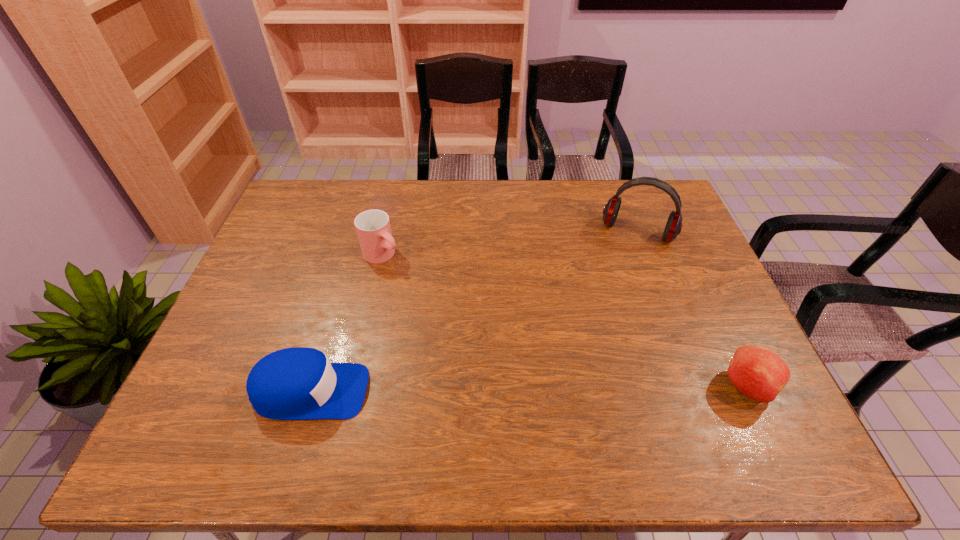
Where is `empty space between the cup and the earphone`? The image size is (960, 540). empty space between the cup and the earphone is located at coordinates (510, 243).

I want to click on free spot between the cup and the earphone, so click(x=510, y=243).

You are a GUI agent. You are given a task and a screenshot of the screen. Output one action in this format:
    pyautogui.click(x=<x>, y=<y>)
    Task: Click on the free space between the tallest object and the cup
    This screenshot has width=960, height=540.
    Given the screenshot: What is the action you would take?
    pyautogui.click(x=510, y=243)

Find the location of a particular element. The width and height of the screenshot is (960, 540). vacant area that lies between the cup and the tallest object is located at coordinates (510, 243).

The image size is (960, 540). Find the location of `vacant space that's between the apple and the baseball cap`. vacant space that's between the apple and the baseball cap is located at coordinates (529, 389).

Locate an element on the screen. vacant space in between the apple and the tallest object is located at coordinates (692, 309).

Find the location of a particular element. free space between the cup and the baseball cap is located at coordinates (347, 323).

At what (x,y) coordinates should I click in order to perform the action: click on object that is the closest to the earphone. Please return your answer as a coordinate pair (x, y). The height and width of the screenshot is (540, 960). Looking at the image, I should click on (758, 373).

Locate which object ranks in proximity to the apple. Please provide its 2D coordinates. Your answer should be formatted as a tuple, i.e. [(x, y)], where the tuple contains the x and y coordinates of a point satisfying the conditions above.

[(673, 227)]